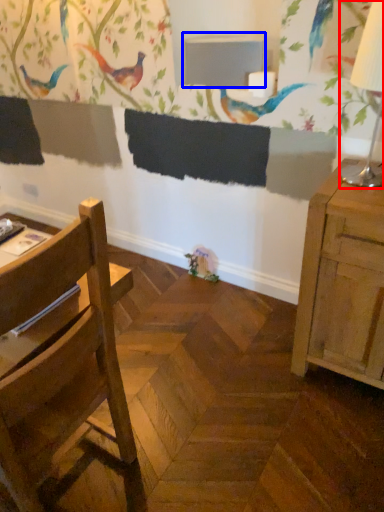
Question: Which of the following is the closest to the observer, table lamp (highlighted by a red box) or table (highlighted by a blue box)?

Choices:
 (A) table lamp
 (B) table

Answer: (A)